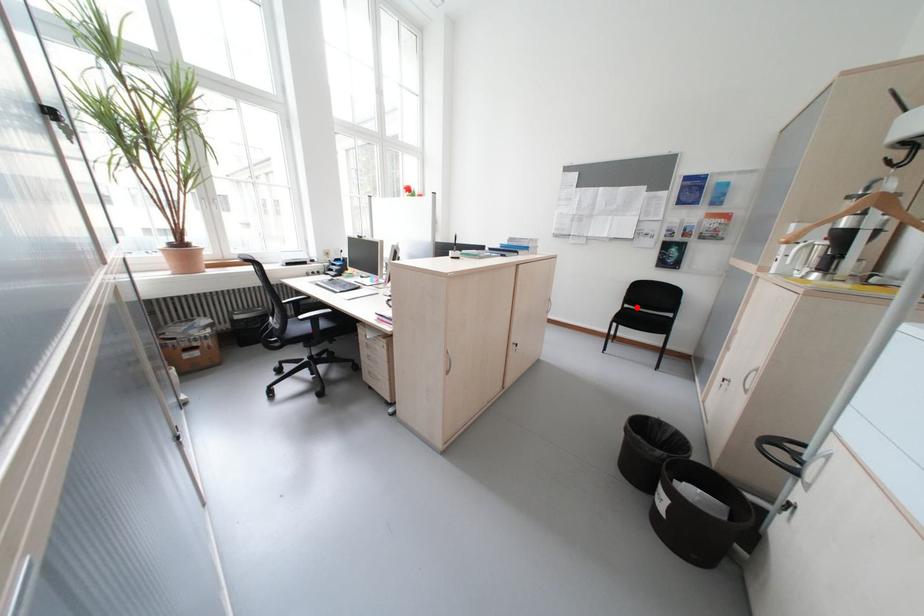
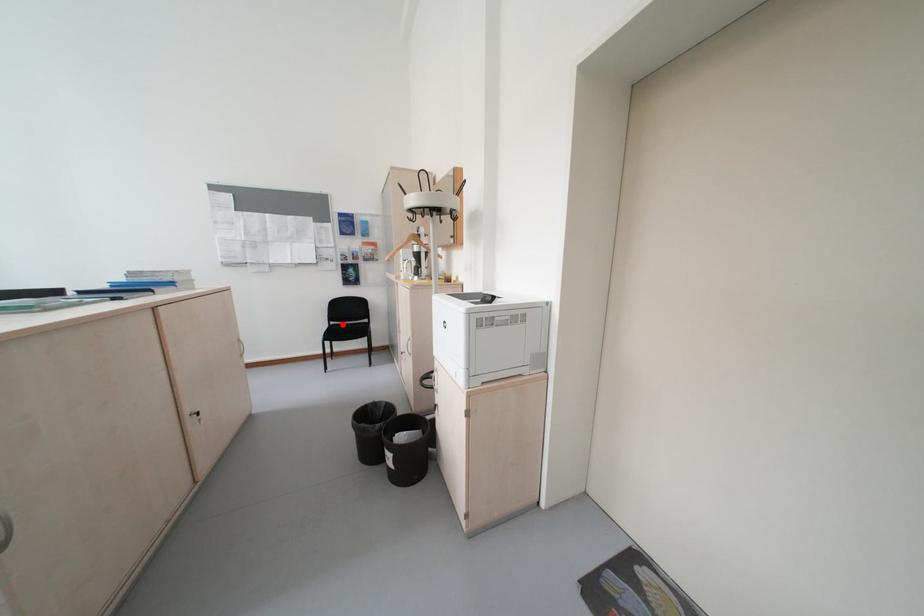
I am providing you with two images of the same scene from different viewpoints. A red point is marked on the first image and another point is marked on the second image. Does the point marked in image1 correspond to the same location as the one in image2?

Yes